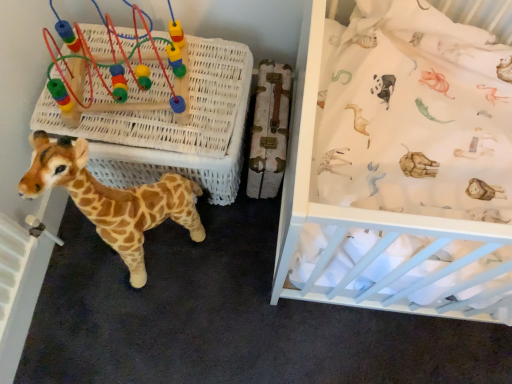
Question: Is soft plush giraffe at lower left surrounded by white fabric at upper right?

Choices:
 (A) no
 (B) yes

Answer: (A)

Question: Considering the relative sizes of white fabric at upper right and soft plush giraffe at lower left in the image provided, is white fabric at upper right shorter than soft plush giraffe at lower left?

Choices:
 (A) yes
 (B) no

Answer: (B)

Question: Is white fabric at upper right turned away from soft plush giraffe at lower left?

Choices:
 (A) no
 (B) yes

Answer: (A)

Question: Is white fabric at upper right positioned in front of soft plush giraffe at lower left?

Choices:
 (A) yes
 (B) no

Answer: (A)

Question: Is white fabric at upper right smaller than soft plush giraffe at lower left?

Choices:
 (A) no
 (B) yes

Answer: (A)

Question: From a real-world perspective, is soft plush giraffe at lower left above or below white wicker basket at center?

Choices:
 (A) above
 (B) below

Answer: (A)

Question: Would you say soft plush giraffe at lower left is to the left or to the right of white wicker basket at center in the picture?

Choices:
 (A) right
 (B) left

Answer: (B)

Question: Does point (91, 193) appear closer or farther from the camera than point (199, 94)?

Choices:
 (A) closer
 (B) farther

Answer: (A)

Question: In the image, is soft plush giraffe at lower left positioned in front of or behind white wicker basket at center?

Choices:
 (A) front
 (B) behind

Answer: (A)

Question: From a real-world perspective, is white wicker basket at center physically located above or below white fabric at upper right?

Choices:
 (A) above
 (B) below

Answer: (B)

Question: Looking at their shapes, would you say white wicker basket at center is wider or thinner than white fabric at upper right?

Choices:
 (A) thin
 (B) wide

Answer: (A)

Question: From the image's perspective, is white wicker basket at center located above or below white fabric at upper right?

Choices:
 (A) above
 (B) below

Answer: (A)

Question: Considering the positions of white wicker basket at center and white fabric at upper right in the image, is white wicker basket at center taller or shorter than white fabric at upper right?

Choices:
 (A) short
 (B) tall

Answer: (A)

Question: Considering their positions, is soft plush giraffe at lower left located in front of or behind white fabric at upper right?

Choices:
 (A) behind
 (B) front

Answer: (A)

Question: Is soft plush giraffe at lower left inside or outside of white fabric at upper right?

Choices:
 (A) outside
 (B) inside

Answer: (A)